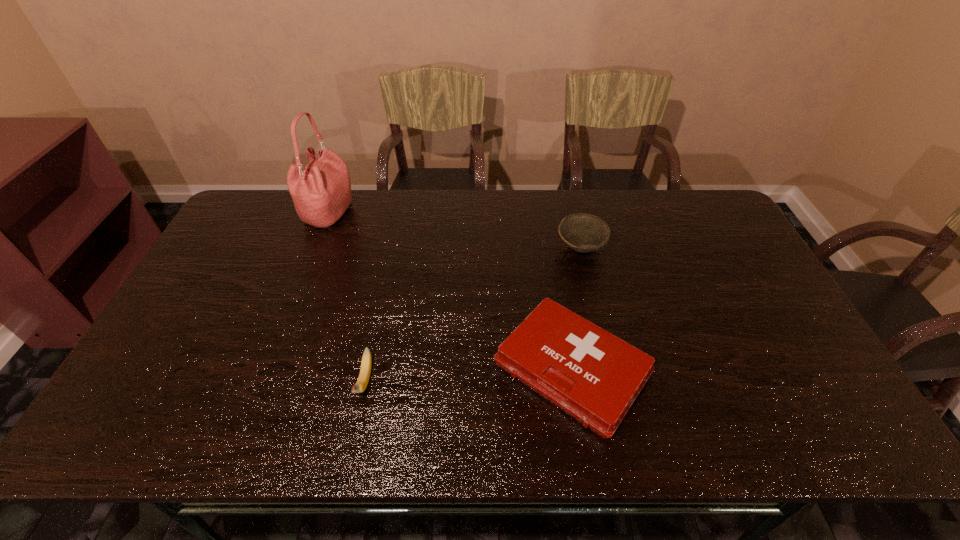
Identify the location of vacant space in between the bowl and the banana. (472, 314).

Where is `empty space between the shortest object and the banana`? The image size is (960, 540). empty space between the shortest object and the banana is located at coordinates (468, 375).

Where is `free space between the second object from left to right and the shortest object`? This screenshot has height=540, width=960. free space between the second object from left to right and the shortest object is located at coordinates pyautogui.click(x=468, y=375).

Locate an element on the screen. This screenshot has height=540, width=960. free space between the first-aid kit and the leftmost object is located at coordinates (450, 291).

Where is `vacant area between the bowl and the tallest object`? The height and width of the screenshot is (540, 960). vacant area between the bowl and the tallest object is located at coordinates (455, 231).

I want to click on vacant area that lies between the bowl and the shortest object, so click(576, 308).

Find the location of a particular element. The width and height of the screenshot is (960, 540). empty space that is in between the second object from left to right and the bowl is located at coordinates (472, 314).

You are a GUI agent. You are given a task and a screenshot of the screen. Output one action in this format:
    pyautogui.click(x=<x>, y=<y>)
    Task: Click on the closest object to the first-aid kit
    
    Given the screenshot: What is the action you would take?
    pyautogui.click(x=582, y=232)

The width and height of the screenshot is (960, 540). I want to click on the third closest object to the banana, so click(582, 232).